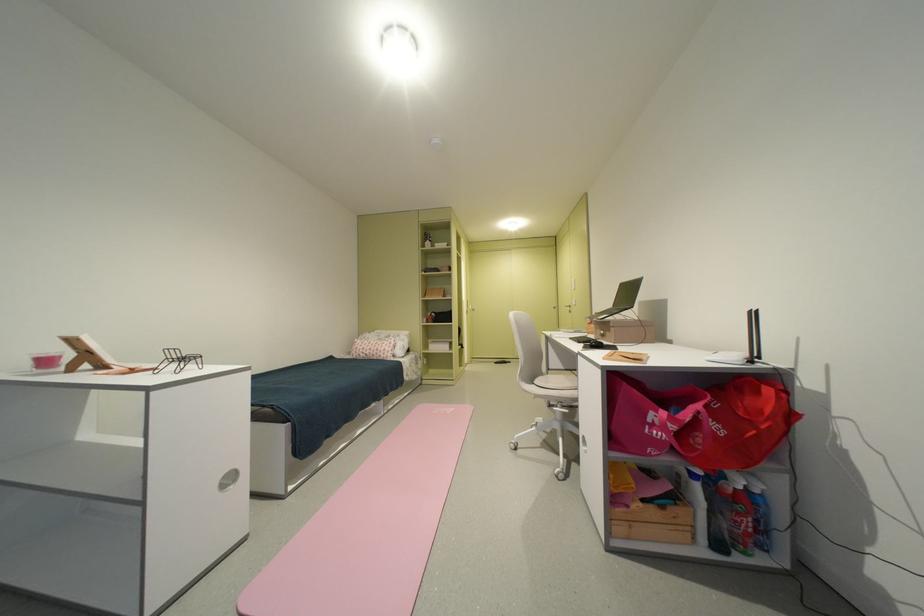
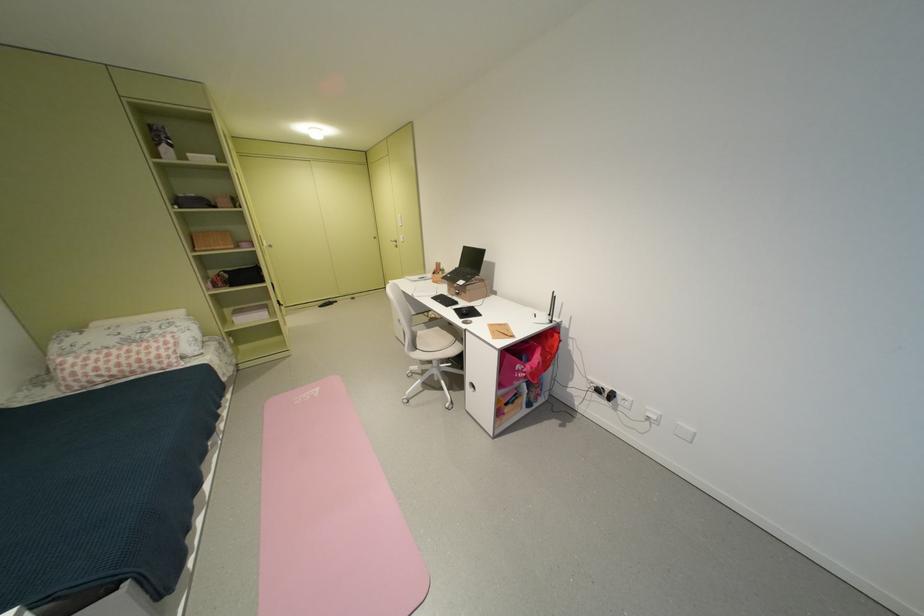
In the second image, find the point that corresponds to point 564,309 in the first image.

(383, 238)